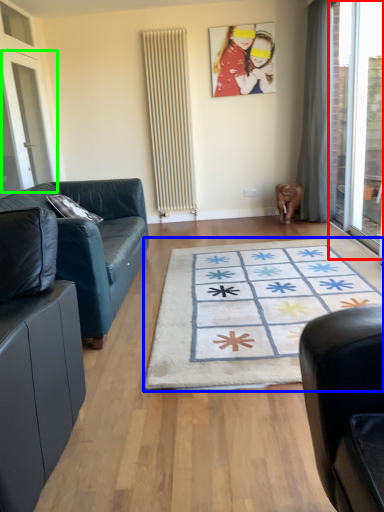
Question: Estimate the real-world distances between objects in this image. Which object is closer to window screen (highlighted by a red box), mat (highlighted by a blue box) or screen door (highlighted by a green box)?

Choices:
 (A) mat
 (B) screen door

Answer: (A)